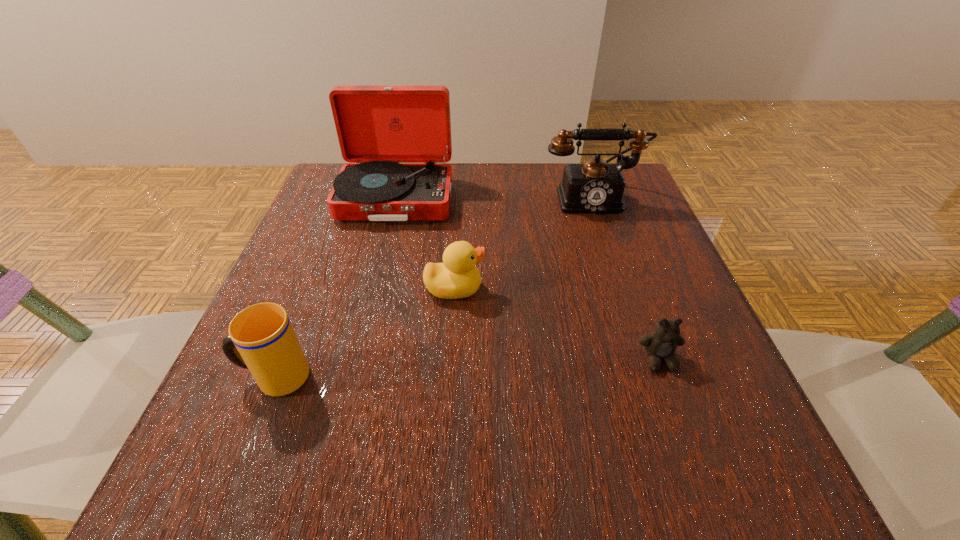
Identify the location of phonograph_record located in the far edge section of the desktop. The height and width of the screenshot is (540, 960). (397, 139).

Where is `telephone at the far edge`? This screenshot has height=540, width=960. telephone at the far edge is located at coordinates (593, 187).

Locate an element on the screen. This screenshot has width=960, height=540. phonograph_record situated at the left edge is located at coordinates (397, 139).

Find the location of a particular element. Image resolution: width=960 pixels, height=540 pixels. cup situated at the left edge is located at coordinates (267, 345).

The image size is (960, 540). Identify the location of telephone present at the right edge. pyautogui.click(x=593, y=187).

I want to click on teddy bear located at the right edge, so click(661, 344).

This screenshot has height=540, width=960. Find the location of `object located at the far left corner`. object located at the far left corner is located at coordinates (397, 139).

Locate an element on the screen. object at the far right corner is located at coordinates click(593, 187).

Locate an element on the screen. This screenshot has height=540, width=960. free space at the far edge of the desktop is located at coordinates 473,163.

The height and width of the screenshot is (540, 960). In the image, there is a desktop. What are the coordinates of `free space at the near edge` in the screenshot? It's located at (547, 469).